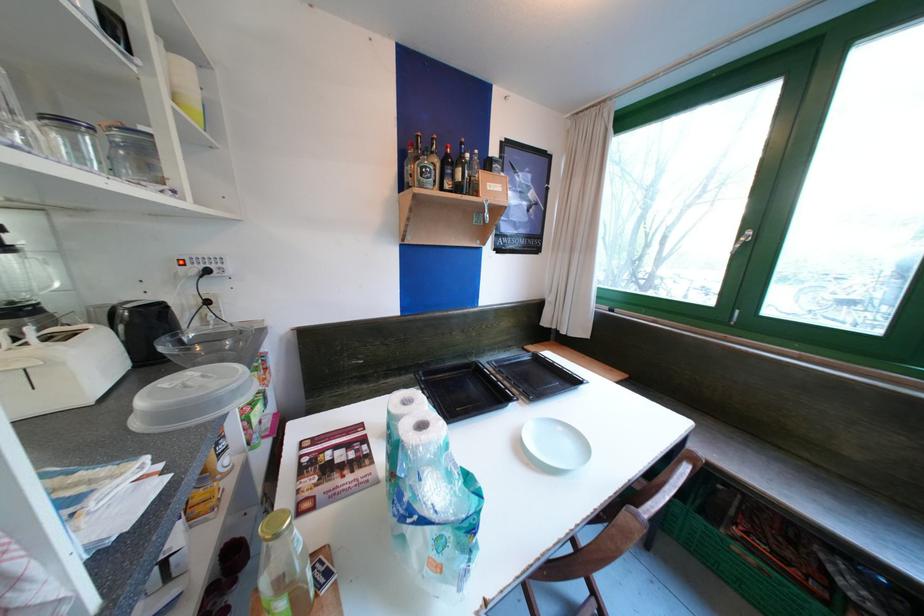
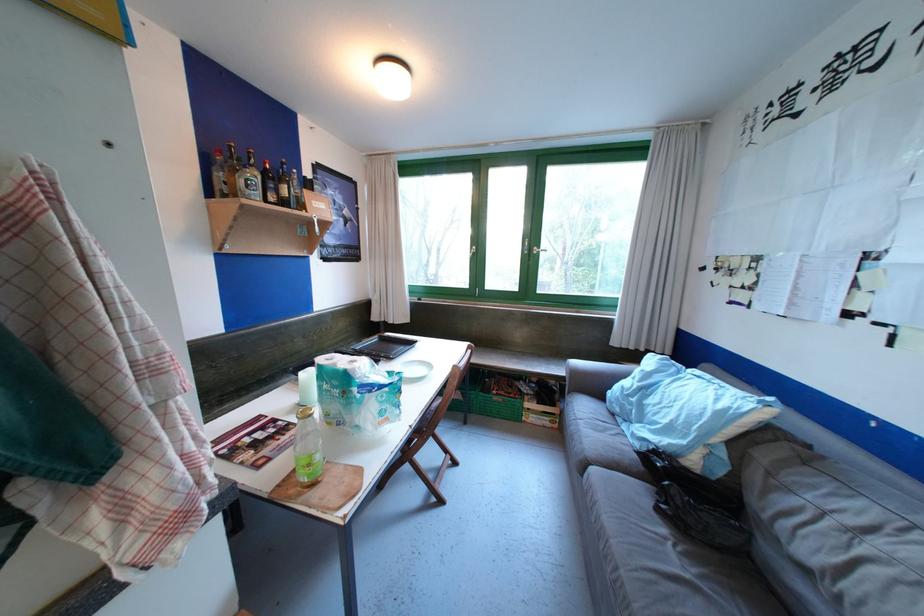
The point at (429, 176) is marked in the first image. Where is the corresponding point in the second image?

(254, 188)